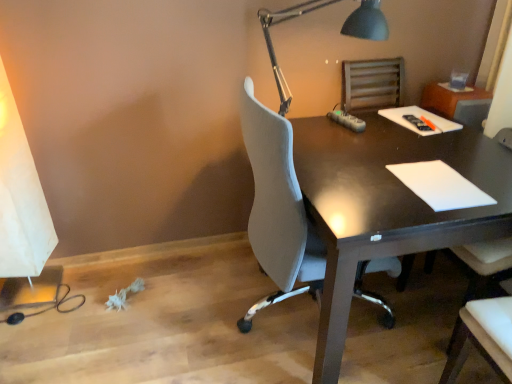
Question: From a real-world perspective, is metallic gray desk lamp at upper right located beneath white matte notepad at right?

Choices:
 (A) yes
 (B) no

Answer: (B)

Question: Is metallic gray desk lamp at upper right wider than white matte notepad at right?

Choices:
 (A) no
 (B) yes

Answer: (B)

Question: Are metallic gray desk lamp at upper right and white matte notepad at right beside each other?

Choices:
 (A) yes
 (B) no

Answer: (B)

Question: Is metallic gray desk lamp at upper right facing away from white matte notepad at right?

Choices:
 (A) yes
 (B) no

Answer: (B)

Question: Can you confirm if metallic gray desk lamp at upper right is shorter than white matte notepad at right?

Choices:
 (A) no
 (B) yes

Answer: (A)

Question: Is there a large distance between metallic gray desk lamp at upper right and white matte notepad at right?

Choices:
 (A) no
 (B) yes

Answer: (A)

Question: From a real-world perspective, is dark wood desk at center physically below white matte notepad at right?

Choices:
 (A) no
 (B) yes

Answer: (B)

Question: Can you confirm if dark wood desk at center is positioned to the right of white matte notepad at right?

Choices:
 (A) no
 (B) yes

Answer: (A)

Question: Is dark wood desk at center to the left of white matte notepad at right from the viewer's perspective?

Choices:
 (A) no
 (B) yes

Answer: (B)

Question: Is dark wood desk at center shorter than white matte notepad at right?

Choices:
 (A) no
 (B) yes

Answer: (A)

Question: Is dark wood desk at center taller than white matte notepad at right?

Choices:
 (A) no
 (B) yes

Answer: (B)

Question: Is dark wood desk at center wider than white matte notepad at right?

Choices:
 (A) no
 (B) yes

Answer: (B)

Question: Is white matte notepad at right further to camera compared to dark wood desk at center?

Choices:
 (A) no
 (B) yes

Answer: (B)